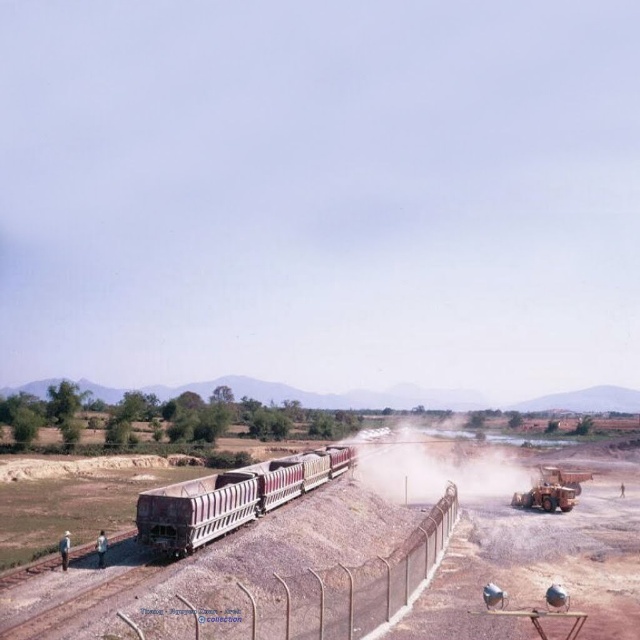
You are a pedestrian standing on the side of the railway track. You see the metallic wire fence at lower center and the rusty metal train carriages at center. Which object is closer to the construction site on the right?

The metallic wire fence at lower center is closer to the construction site on the right because it is positioned to the right of the rusty metal train carriages at center, which are further away from the construction site.

You are a photographer trying to capture the train scene. You notice the rusty metal train carriages at center and the dusty yellow steam at center. Which object appears narrower in the image?

The rusty metal train carriages at center is thinner than dusty yellow steam at center, so the rusty metal train carriages at center appears narrower in the image.

Based on the photo, you are a photographer trying to capture the entire scene of the train and the construction site. You notice the metallic wire fence at lower center and the dusty yellow steam at center. Which of these two objects has a smaller width in the image?

The metallic wire fence at lower center has a smaller width than the dusty yellow steam at center.